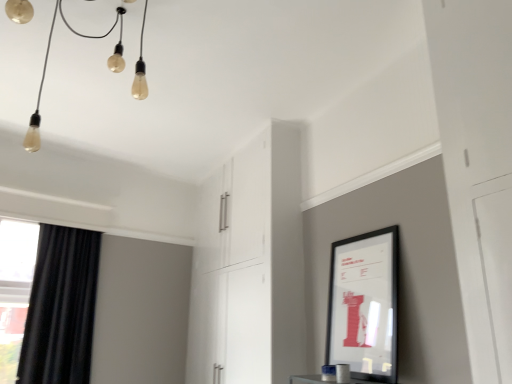
Question: From a real-world perspective, relative to black matte picture frame at upper right, is black velvet curtain at left vertically above or below?

Choices:
 (A) above
 (B) below

Answer: (A)

Question: From their relative heights in the image, would you say black velvet curtain at left is taller or shorter than black matte picture frame at upper right?

Choices:
 (A) short
 (B) tall

Answer: (B)

Question: Which is nearer to the black matte picture frame at upper right?

Choices:
 (A) matte glass lightbulbs at upper left
 (B) black velvet curtain at left
 (C) white glossy cabinet at center

Answer: (C)

Question: Estimate the real-world distances between objects in this image. Which object is closer to the matte glass lightbulbs at upper left?

Choices:
 (A) black velvet curtain at left
 (B) white glossy cabinet at center
 (C) black matte picture frame at upper right

Answer: (A)